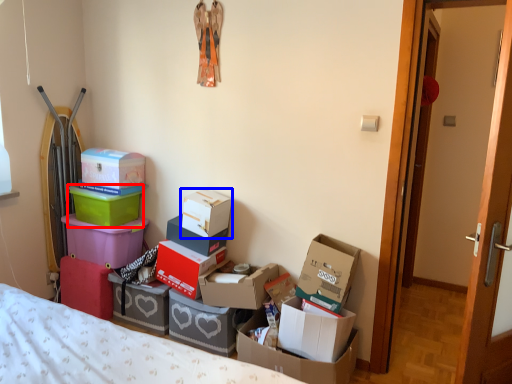
Question: Which object is further to the camera taking this photo, box (highlighted by a red box) or box (highlighted by a blue box)?

Choices:
 (A) box
 (B) box

Answer: (A)